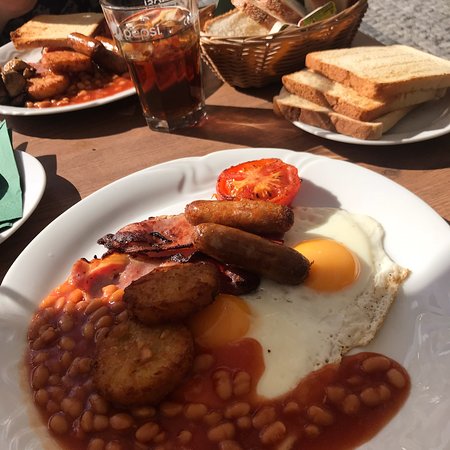
The height and width of the screenshot is (450, 450). Find the location of `basket`. basket is located at coordinates (262, 60).